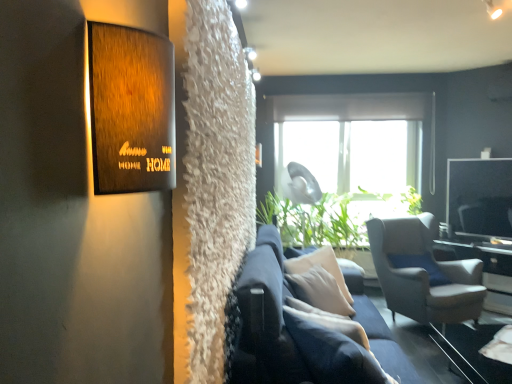
Question: Does matte gray fabric armchair at right appear on the left side of white glossy table at right?

Choices:
 (A) yes
 (B) no

Answer: (A)

Question: Is matte gray fabric armchair at right bigger than white glossy table at right?

Choices:
 (A) yes
 (B) no

Answer: (A)

Question: Can you confirm if matte gray fabric armchair at right is positioned to the right of white glossy table at right?

Choices:
 (A) yes
 (B) no

Answer: (B)

Question: Can you confirm if matte gray fabric armchair at right is taller than white glossy table at right?

Choices:
 (A) yes
 (B) no

Answer: (A)

Question: Is matte gray fabric armchair at right positioned behind white glossy table at right?

Choices:
 (A) yes
 (B) no

Answer: (B)

Question: Considering the positions of white glossy table at right and navy blue fabric couch at center in the image, is white glossy table at right bigger or smaller than navy blue fabric couch at center?

Choices:
 (A) small
 (B) big

Answer: (B)

Question: Relative to navy blue fabric couch at center, is white glossy table at right in front or behind?

Choices:
 (A) front
 (B) behind

Answer: (B)

Question: Considering the positions of white glossy table at right and navy blue fabric couch at center in the image, is white glossy table at right taller or shorter than navy blue fabric couch at center?

Choices:
 (A) short
 (B) tall

Answer: (A)

Question: Is white glossy table at right inside the boundaries of navy blue fabric couch at center, or outside?

Choices:
 (A) inside
 (B) outside

Answer: (B)

Question: Would you say transparent glass table at lower right is to the left or to the right of matte gray fabric armchair at right in the picture?

Choices:
 (A) left
 (B) right

Answer: (A)

Question: Looking at their shapes, would you say transparent glass table at lower right is wider or thinner than matte gray fabric armchair at right?

Choices:
 (A) wide
 (B) thin

Answer: (B)

Question: From the image's perspective, is transparent glass table at lower right positioned above or below matte gray fabric armchair at right?

Choices:
 (A) below
 (B) above

Answer: (A)

Question: Considering the positions of transparent glass table at lower right and matte gray fabric armchair at right in the image, is transparent glass table at lower right bigger or smaller than matte gray fabric armchair at right?

Choices:
 (A) big
 (B) small

Answer: (B)

Question: From the image's perspective, is transparent glass table at lower right located above or below navy blue fabric couch at center?

Choices:
 (A) below
 (B) above

Answer: (A)

Question: Is transparent glass table at lower right situated inside navy blue fabric couch at center or outside?

Choices:
 (A) outside
 (B) inside

Answer: (A)